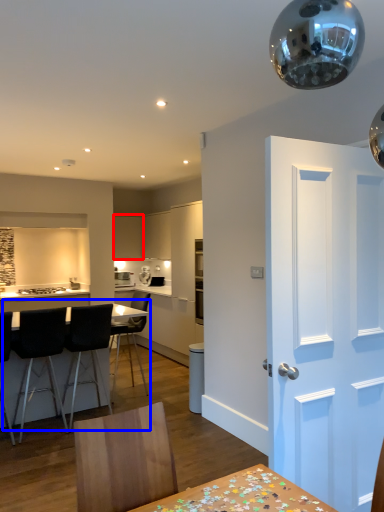
Question: Among these objects, which one is nearest to the camera, cabinetry (highlighted by a red box) or kitchen & dining room table (highlighted by a blue box)?

Choices:
 (A) cabinetry
 (B) kitchen & dining room table

Answer: (B)